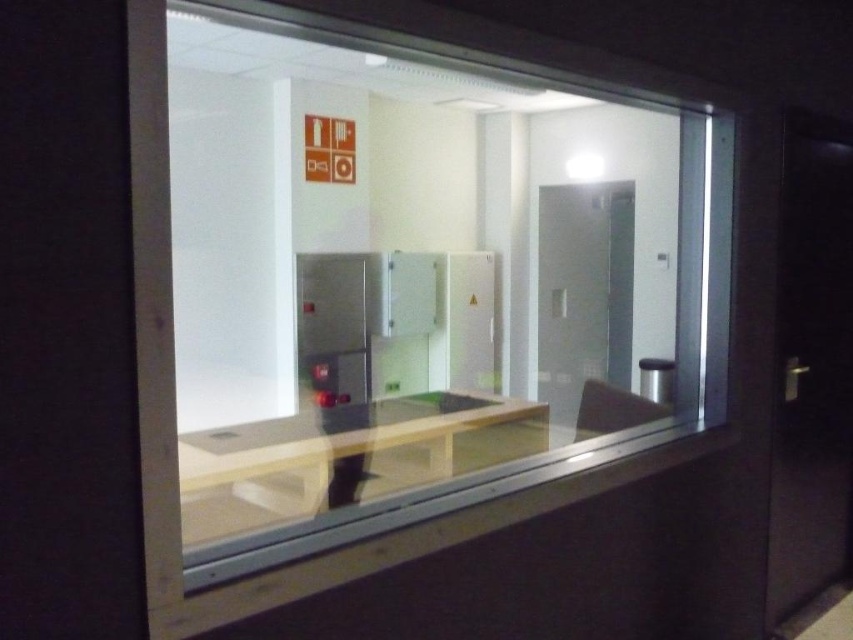
Question: Which of the following is the closest to the observer?

Choices:
 (A) (596, 378)
 (B) (606, 346)

Answer: (B)

Question: Which point is closer to the camera taking this photo?

Choices:
 (A) (503, 348)
 (B) (631, 240)

Answer: (B)

Question: Considering the relative positions of transparent glass window at center and transparent glass elevator at center in the image provided, where is transparent glass window at center located with respect to transparent glass elevator at center?

Choices:
 (A) above
 (B) below

Answer: (A)

Question: Is transparent glass window at center smaller than transparent glass elevator at center?

Choices:
 (A) yes
 (B) no

Answer: (B)

Question: Does transparent glass window at center appear on the left side of transparent glass elevator at center?

Choices:
 (A) no
 (B) yes

Answer: (B)